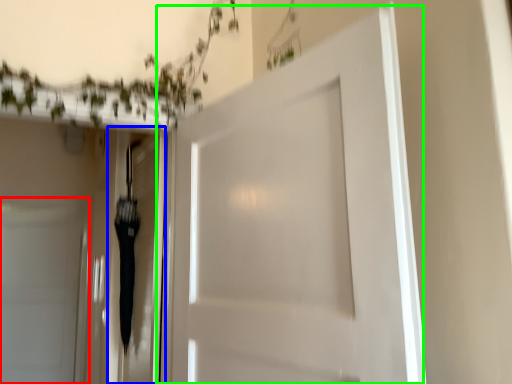
Question: Considering the real-world distances, which object is farthest from door (highlighted by a red box)? elevator (highlighted by a blue box) or door (highlighted by a green box)?

Choices:
 (A) elevator
 (B) door

Answer: (B)